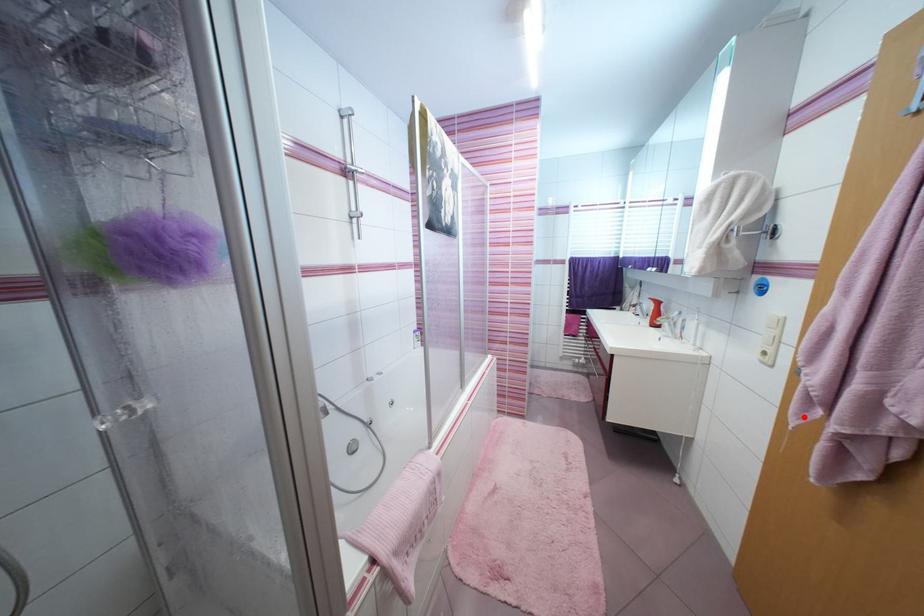
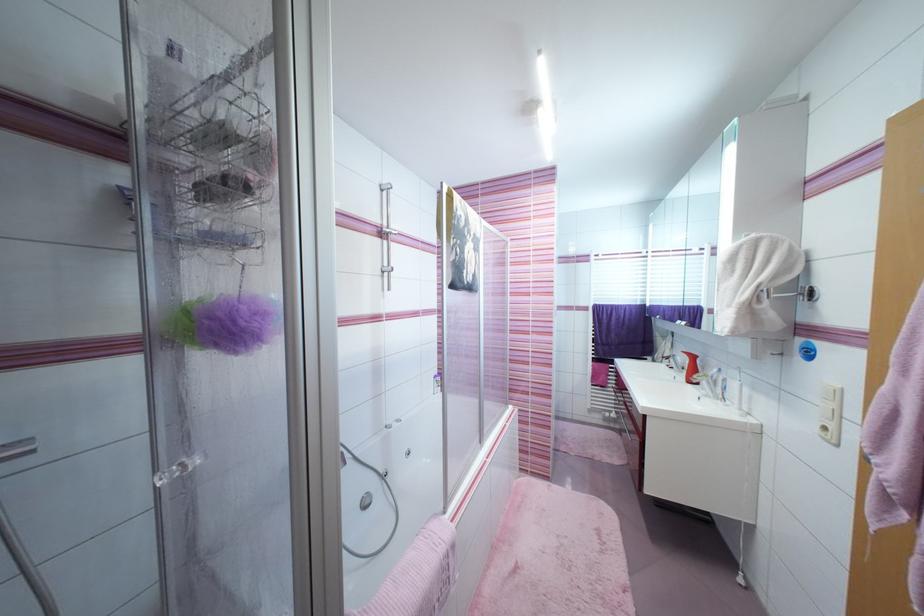
Find the pixel in the second image that matches the highlighted location in the first image.

(883, 517)